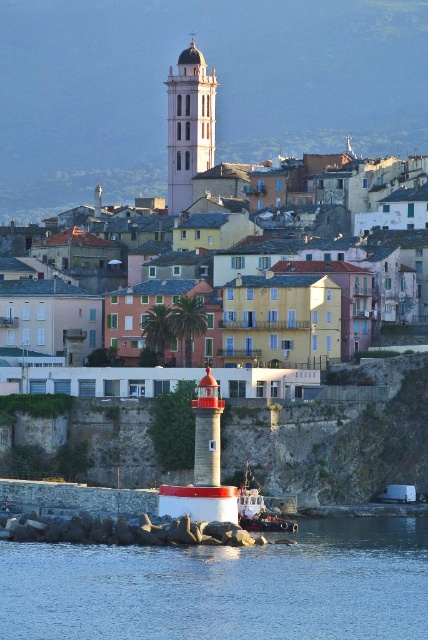
Which of these two, matte pink building at upper center or smooth white tower at center, stands shorter?

matte pink building at upper center

Who is higher up, matte pink building at upper center or smooth white tower at center?

Positioned higher is smooth white tower at center.

Who is more distant from viewer, (353, 349) or (189, 184)?

Point (189, 184)

The height and width of the screenshot is (640, 428). In order to click on matte pink building at upper center in this screenshot , I will do `click(315, 285)`.

Locate an element on the screen. The image size is (428, 640). clear water at center is located at coordinates (225, 588).

Is point (360, 611) positioned in front of point (205, 145)?

That is True.

Locate an element on the screen. The image size is (428, 640). clear water at center is located at coordinates (225, 588).

Does smooth white tower at center have a larger size compared to white plastic boat at lower center?

Yes, smooth white tower at center is bigger than white plastic boat at lower center.

From the picture: Between smooth white tower at center and white plastic boat at lower center, which one is positioned lower?

white plastic boat at lower center is below.

Does point (178, 161) come in front of point (252, 518)?

No, (178, 161) is further to viewer.

The height and width of the screenshot is (640, 428). Identify the location of smooth white tower at center. (189, 125).